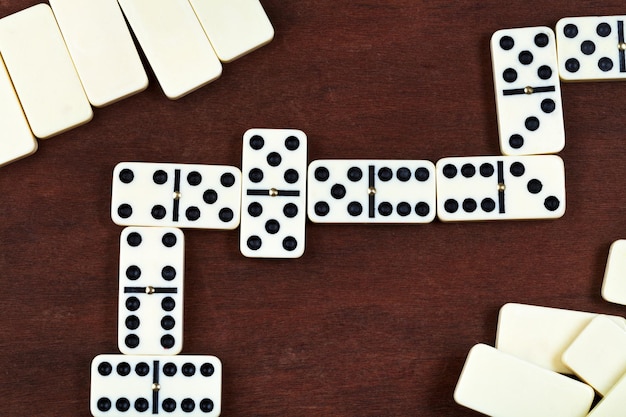
At what (x,y) coordinates should I click in order to perform the action: click on dividers. Please return your answer as a coordinate pair (x, y). Looking at the image, I should click on click(155, 382), click(150, 288), click(178, 189), click(260, 192), click(367, 195), click(501, 193), click(513, 87).